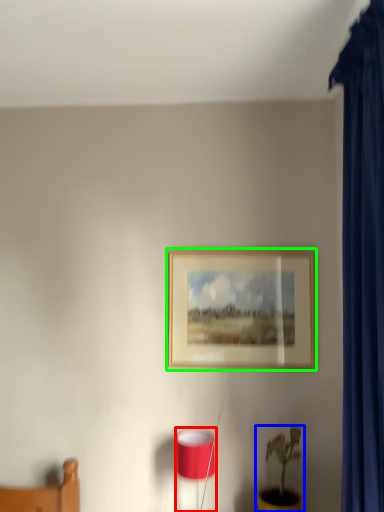
Question: Based on their relative distances, which object is nearer to table lamp (highlighted by a red box)? Choose from houseplant (highlighted by a blue box) and picture frame (highlighted by a green box).

Choices:
 (A) houseplant
 (B) picture frame

Answer: (A)